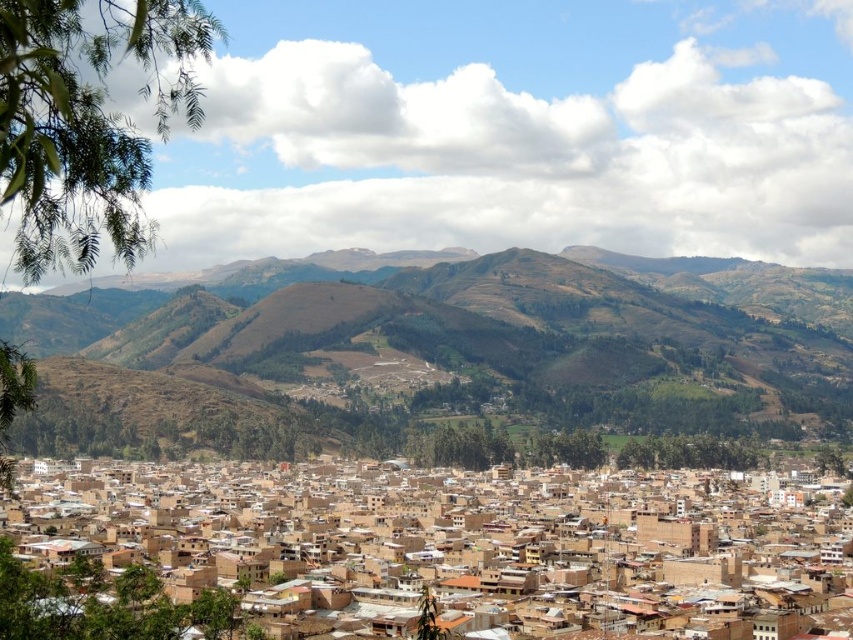
Is brown clay buildings at center to the right of brown textured hillside at center from the viewer's perspective?

Incorrect, brown clay buildings at center is not on the right side of brown textured hillside at center.

Which is more to the left, brown clay buildings at center or brown textured hillside at center?

brown clay buildings at center

The height and width of the screenshot is (640, 853). What do you see at coordinates (418, 557) in the screenshot? I see `brown clay buildings at center` at bounding box center [418, 557].

Identify the location of brown clay buildings at center. Image resolution: width=853 pixels, height=640 pixels. (418, 557).